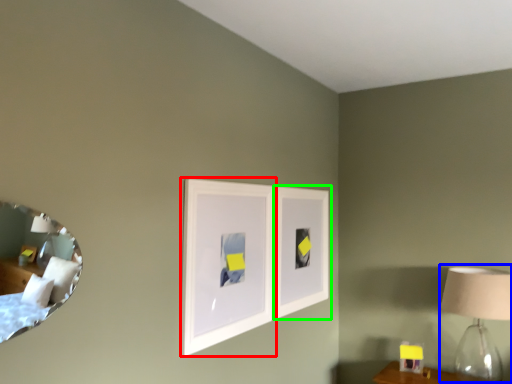
Question: Estimate the real-world distances between objects in this image. Which object is closer to picture frame (highlighted by a red box), table lamp (highlighted by a blue box) or picture frame (highlighted by a green box)?

Choices:
 (A) table lamp
 (B) picture frame

Answer: (B)